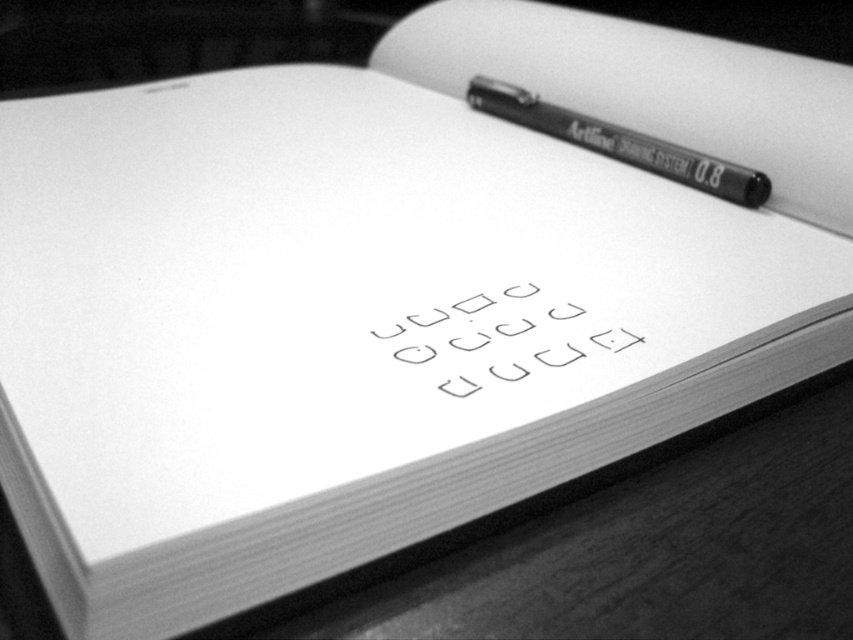
You are an artist trying to sketch on the white paper at center. The black matte pen at upper right is in your way. Can you move the pen to the side without lifting the paper?

The white paper at center has a lesser height compared to the black matte pen at upper right, so you can move the pen to the side without lifting the paper since the pen is taller and can be shifted over the edge of the paper.